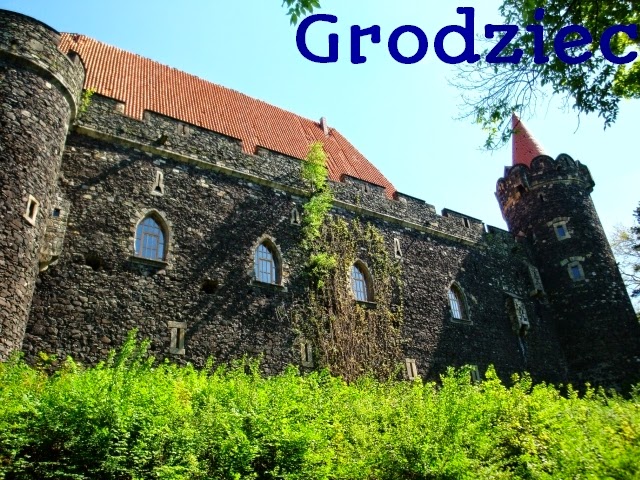
Locate an element on the screen. slit windows is located at coordinates (32, 209), (177, 336), (306, 350), (159, 183), (411, 368), (396, 244).